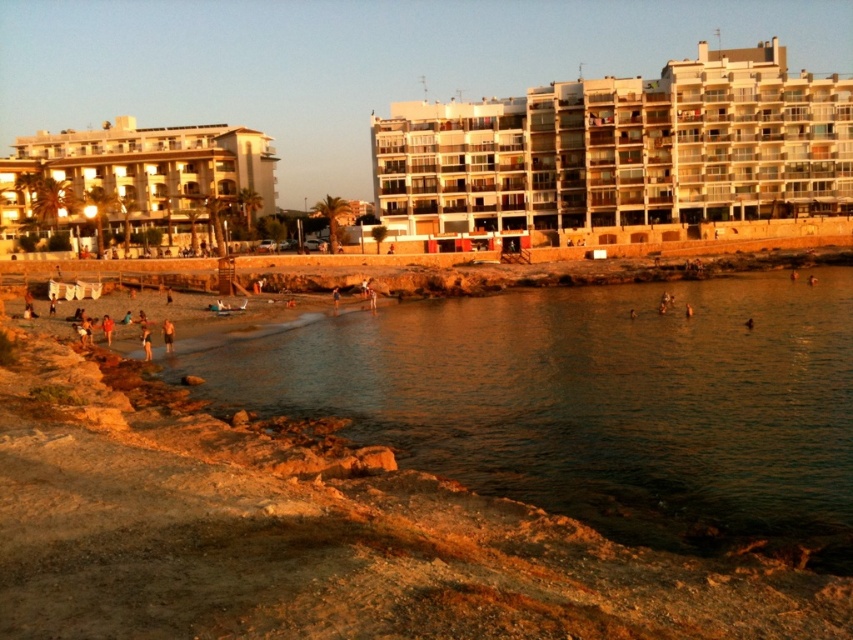
You are a beachgoer who wants to build a sandcastle. You have two options for locations on the beach. One is the light brown sand at beach center and the other is the light brown sand at lower left. Which location would you choose and why?

You should choose the light brown sand at lower left because it is larger than the light brown sand at beach center, making it more suitable for building a sandcastle as larger sand grains hold together better.

You are planning to build a small sandcastle on the beach. Given the scene, which area would you choose between the shiny brown water at lower center and the light brown sand at beach center, and why?

The light brown sand at beach center is the better choice for building a sandcastle because the shiny brown water at lower center might be wider, indicating it is closer to the water where the sand might be too wet or submerged.

You are standing at the point marked as point (167,336) on the beach. What is the color of the sand directly beneath your feet?

The light brown sand at beach center is located at point (167,336), so the sand beneath your feet is light brown.